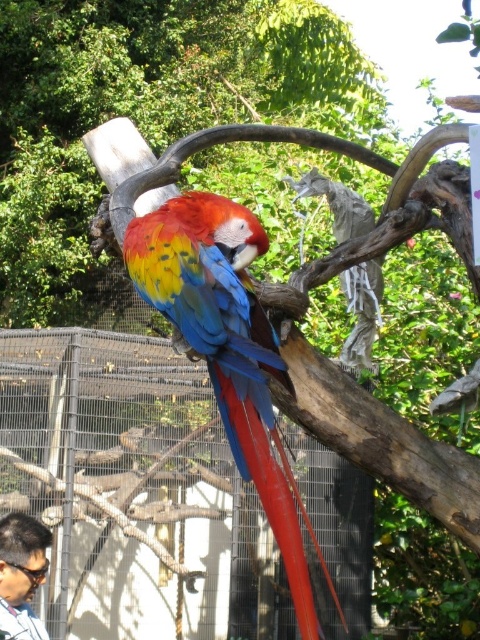
Describe the element at coordinates (228, 349) in the screenshot. I see `shiny multicolored parrot at center` at that location.

Is shiny multicolored parrot at center behind dark brown hair at lower left?

No.

Identify the location of shiny multicolored parrot at center. (228, 349).